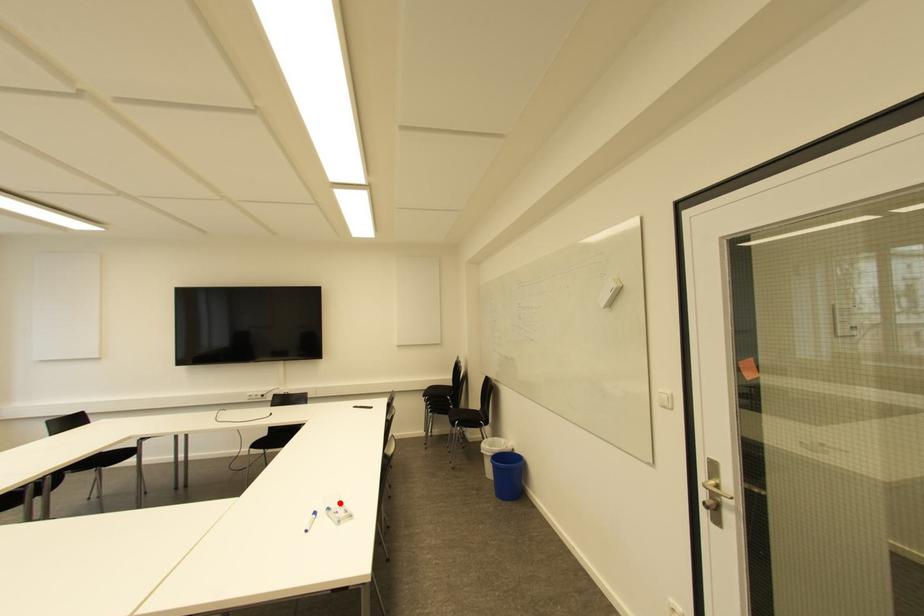
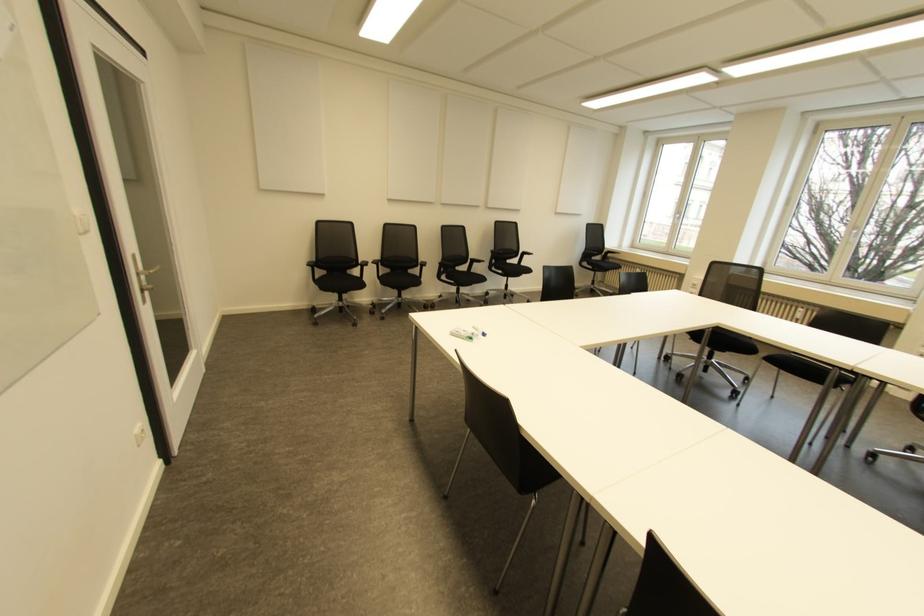
Question: I am providing you with two images of the same scene from different viewpoints. A red point is marked on the first image. Is the red point's position out of view in image 2?

Choices:
 (A) Yes
 (B) No

Answer: (B)